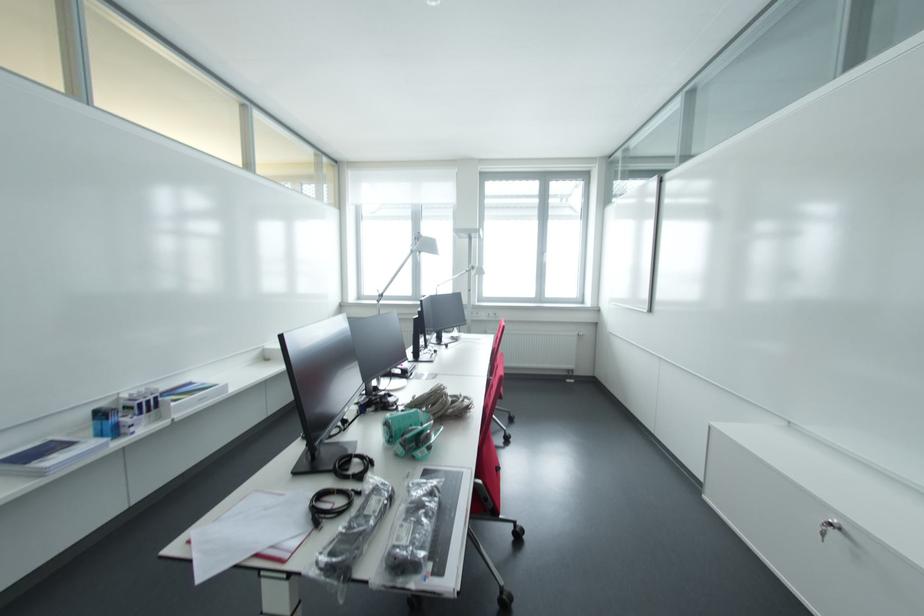
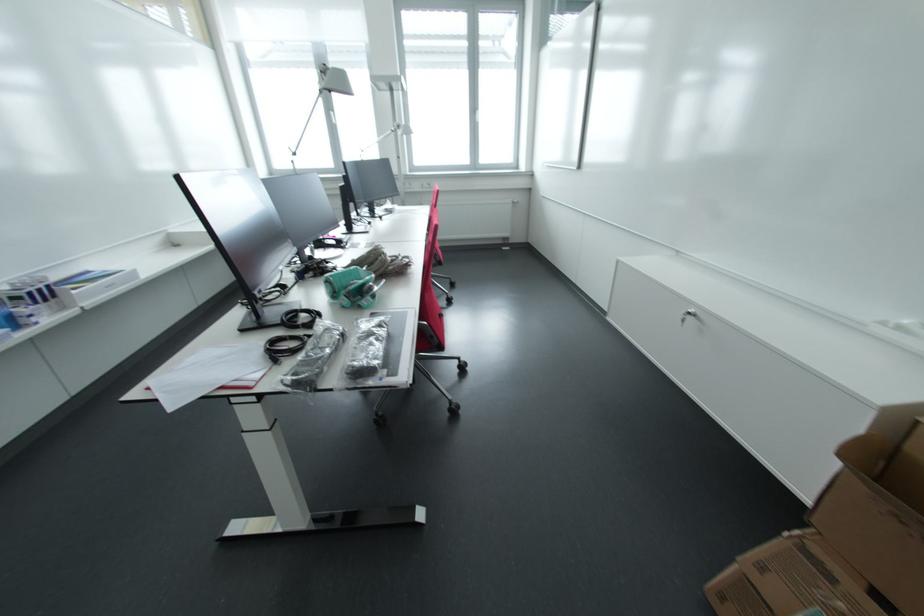
Where in the second image is the point corresponding to [353,529] from the first image?

(310, 358)